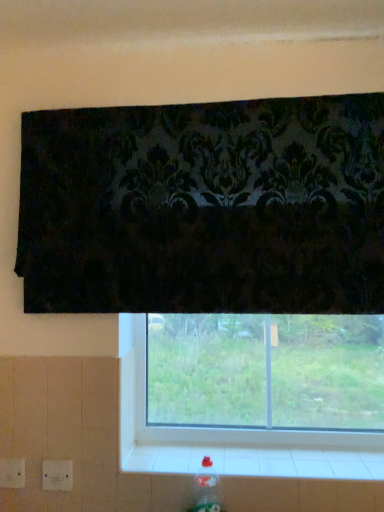
Question: Does clear plastic bottle at lower right have a smaller size compared to transparent glass window at center?

Choices:
 (A) yes
 (B) no

Answer: (A)

Question: Does clear plastic bottle at lower right have a lesser width compared to transparent glass window at center?

Choices:
 (A) no
 (B) yes

Answer: (A)

Question: Is clear plastic bottle at lower right far from transparent glass window at center?

Choices:
 (A) no
 (B) yes

Answer: (A)

Question: From a real-world perspective, is clear plastic bottle at lower right positioned under transparent glass window at center based on gravity?

Choices:
 (A) yes
 (B) no

Answer: (A)

Question: From the image's perspective, does clear plastic bottle at lower right appear lower than transparent glass window at center?

Choices:
 (A) yes
 (B) no

Answer: (A)

Question: Does point (337, 438) appear closer or farther from the camera than point (198, 475)?

Choices:
 (A) closer
 (B) farther

Answer: (B)

Question: In terms of height, does transparent glass window at center look taller or shorter compared to clear plastic bottle at lower right?

Choices:
 (A) short
 (B) tall

Answer: (B)

Question: Do you think transparent glass window at center is within clear plastic bottle at lower right, or outside of it?

Choices:
 (A) outside
 (B) inside

Answer: (A)

Question: From a real-world perspective, is transparent glass window at center above or below clear plastic bottle at lower right?

Choices:
 (A) above
 (B) below

Answer: (A)

Question: Is point (200, 497) closer or farther from the camera than point (142, 438)?

Choices:
 (A) farther
 (B) closer

Answer: (B)

Question: In terms of width, does clear plastic bottle at lower right look wider or thinner when compared to transparent glass window at center?

Choices:
 (A) wide
 (B) thin

Answer: (A)

Question: Which is correct: clear plastic bottle at lower right is inside transparent glass window at center, or outside of it?

Choices:
 (A) outside
 (B) inside

Answer: (A)

Question: In the image, is clear plastic bottle at lower right on the left side or the right side of transparent glass window at center?

Choices:
 (A) right
 (B) left

Answer: (B)

Question: Considering the positions of white tile at lower center and clear plastic bottle at lower right in the image, is white tile at lower center bigger or smaller than clear plastic bottle at lower right?

Choices:
 (A) small
 (B) big

Answer: (B)

Question: From a real-world perspective, is white tile at lower center above or below clear plastic bottle at lower right?

Choices:
 (A) above
 (B) below

Answer: (A)